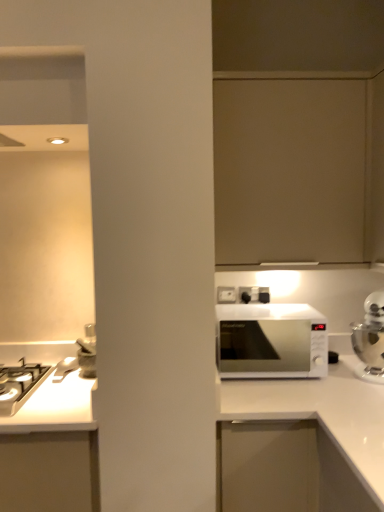
Question: Is white glossy microwave at right not inside white glossy microwave at center?

Choices:
 (A) yes
 (B) no

Answer: (A)

Question: From a real-world perspective, does white glossy microwave at right stand above white glossy microwave at center?

Choices:
 (A) no
 (B) yes

Answer: (A)

Question: Can you confirm if white glossy microwave at right is shorter than white glossy microwave at center?

Choices:
 (A) no
 (B) yes

Answer: (A)

Question: Is the position of white glossy microwave at right more distant than that of white glossy microwave at center?

Choices:
 (A) no
 (B) yes

Answer: (A)

Question: Is white glossy microwave at right bigger than white glossy microwave at center?

Choices:
 (A) no
 (B) yes

Answer: (B)

Question: Considering the relative positions of white glossy microwave at right and white glossy microwave at center in the image provided, is white glossy microwave at right to the right of white glossy microwave at center from the viewer's perspective?

Choices:
 (A) no
 (B) yes

Answer: (B)

Question: Considering the relative sizes of white glossy microwave at right and white plastic electric outlet at upper center in the image provided, is white glossy microwave at right thinner than white plastic electric outlet at upper center?

Choices:
 (A) no
 (B) yes

Answer: (A)

Question: Considering the relative sizes of white glossy microwave at right and white plastic electric outlet at upper center in the image provided, is white glossy microwave at right wider than white plastic electric outlet at upper center?

Choices:
 (A) yes
 (B) no

Answer: (A)

Question: Is white glossy microwave at right to the left of white plastic electric outlet at upper center from the viewer's perspective?

Choices:
 (A) no
 (B) yes

Answer: (A)

Question: Is white glossy microwave at right bigger than white plastic electric outlet at upper center?

Choices:
 (A) no
 (B) yes

Answer: (B)

Question: Considering the relative sizes of white glossy microwave at right and white plastic electric outlet at upper center in the image provided, is white glossy microwave at right shorter than white plastic electric outlet at upper center?

Choices:
 (A) yes
 (B) no

Answer: (B)

Question: From a real-world perspective, is white glossy microwave at right below white plastic electric outlet at upper center?

Choices:
 (A) no
 (B) yes

Answer: (B)

Question: From a real-world perspective, is silver metallic kettle at right below white plastic electric outlet at upper center?

Choices:
 (A) no
 (B) yes

Answer: (B)